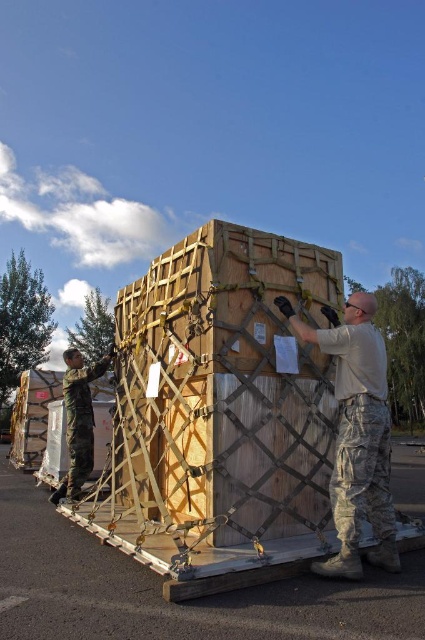
Question: Which point is farther to the camera?

Choices:
 (A) (82, 410)
 (B) (351, 296)

Answer: (A)

Question: Does camouflage uniform at center lie in front of camouflage uniform at left?

Choices:
 (A) yes
 (B) no

Answer: (A)

Question: Can you confirm if camouflage uniform at center is thinner than camouflage uniform at left?

Choices:
 (A) yes
 (B) no

Answer: (A)

Question: Is camouflage uniform at center to the left of camouflage uniform at left from the viewer's perspective?

Choices:
 (A) yes
 (B) no

Answer: (B)

Question: Which object appears closest to the camera in this image?

Choices:
 (A) camouflage uniform at center
 (B) camouflage uniform at left

Answer: (A)